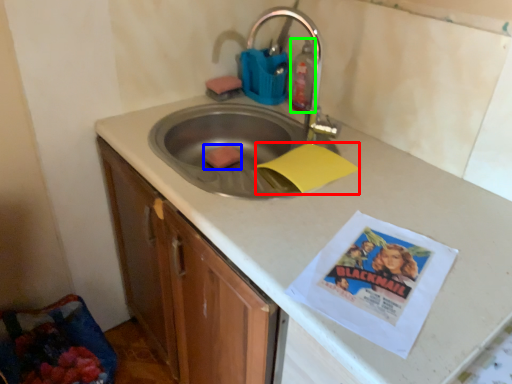
Question: Which object is the farthest from paper (highlighted by a red box)? Choose among these: food (highlighted by a blue box) or cleaning product (highlighted by a green box).

Choices:
 (A) food
 (B) cleaning product

Answer: (A)